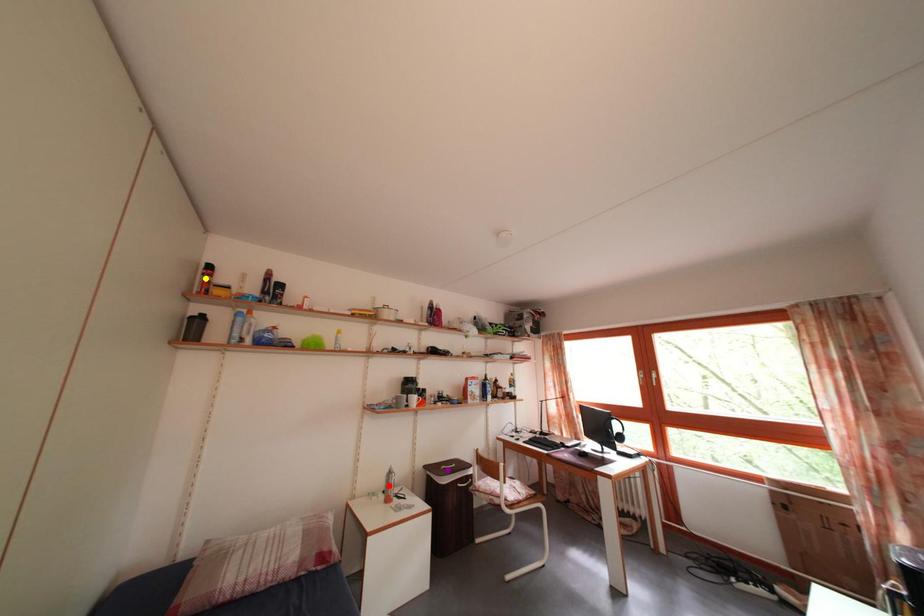
Order these from farthest to nearest:
1. red point
2. purple point
3. yellow point

purple point → red point → yellow point